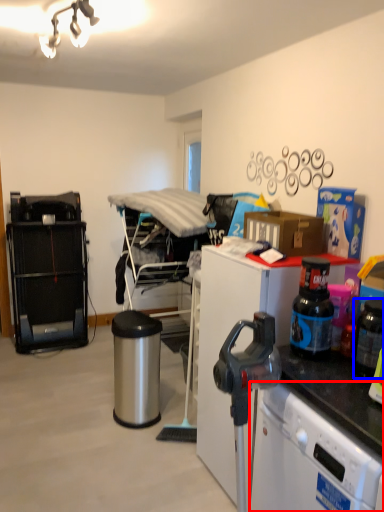
Question: Which point is further to the camera, dish washer (highlighted by a red box) or appliance (highlighted by a blue box)?

Choices:
 (A) dish washer
 (B) appliance

Answer: (B)